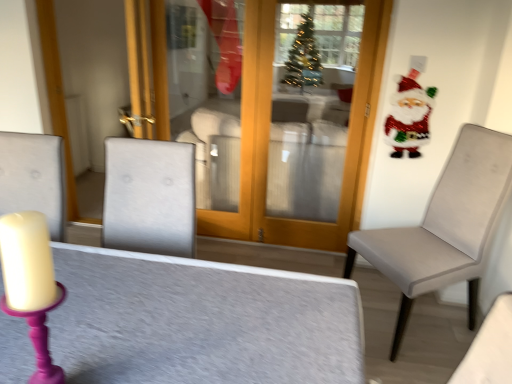
Question: Considering the relative sizes of shiny sequined santa at upper right and textured gray table at center in the image provided, is shiny sequined santa at upper right bigger than textured gray table at center?

Choices:
 (A) yes
 (B) no

Answer: (B)

Question: Is textured gray table at center surrounded by shiny sequined santa at upper right?

Choices:
 (A) no
 (B) yes

Answer: (A)

Question: Considering the relative sizes of shiny sequined santa at upper right and textured gray table at center in the image provided, is shiny sequined santa at upper right thinner than textured gray table at center?

Choices:
 (A) no
 (B) yes

Answer: (B)

Question: Is shiny sequined santa at upper right with textured gray table at center?

Choices:
 (A) yes
 (B) no

Answer: (B)

Question: Is shiny sequined santa at upper right behind textured gray table at center?

Choices:
 (A) no
 (B) yes

Answer: (B)

Question: In the image, is matte gray chair at right positioned in front of or behind shiny sequined santa at upper right?

Choices:
 (A) behind
 (B) front

Answer: (B)

Question: In the image, is matte gray chair at right on the left side or the right side of shiny sequined santa at upper right?

Choices:
 (A) left
 (B) right

Answer: (A)

Question: From the image's perspective, is matte gray chair at right located above or below shiny sequined santa at upper right?

Choices:
 (A) above
 (B) below

Answer: (B)

Question: From a real-world perspective, relative to shiny sequined santa at upper right, is matte gray chair at right vertically above or below?

Choices:
 (A) below
 (B) above

Answer: (A)

Question: Would you say shiny sequined santa at upper right is to the left or to the right of textured gray table at center in the picture?

Choices:
 (A) left
 (B) right

Answer: (B)

Question: Relative to textured gray table at center, is shiny sequined santa at upper right in front or behind?

Choices:
 (A) behind
 (B) front

Answer: (A)

Question: Which is correct: shiny sequined santa at upper right is inside textured gray table at center, or outside of it?

Choices:
 (A) inside
 (B) outside

Answer: (B)

Question: Is point (422, 115) positioned closer to the camera than point (124, 274)?

Choices:
 (A) closer
 (B) farther

Answer: (B)

Question: Is textured gray table at center spatially inside shiny sequined santa at upper right, or outside of it?

Choices:
 (A) inside
 (B) outside

Answer: (B)

Question: Considering the positions of point (223, 304) and point (395, 114), is point (223, 304) closer or farther from the camera than point (395, 114)?

Choices:
 (A) farther
 (B) closer

Answer: (B)